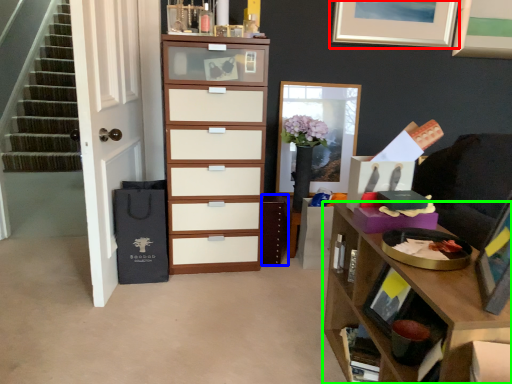
Question: Which is nearer to the picture frame (highlighted by a red box)? cabinetry (highlighted by a blue box) or desk (highlighted by a green box).

Choices:
 (A) cabinetry
 (B) desk

Answer: (A)